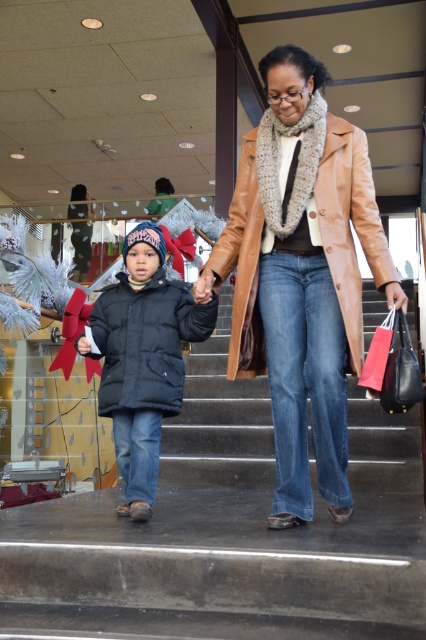
Is leather coat at center taller than matte black jacket at center?

Indeed, leather coat at center has a greater height compared to matte black jacket at center.

Does point (287, 396) come closer to viewer compared to point (123, 369)?

Yes, it is in front of point (123, 369).

I want to click on leather coat at center, so click(301, 275).

Between smooth concrete stairs at center and leather coat at center, which one is positioned higher?

leather coat at center

Does smooth concrete stairs at center have a lesser width compared to leather coat at center?

Incorrect, smooth concrete stairs at center's width is not less than leather coat at center's.

Where is `smooth concrete stairs at center`? smooth concrete stairs at center is located at coordinates (227, 534).

Is smooth concrete stairs at center below matte black jacket at center?

Indeed, smooth concrete stairs at center is positioned under matte black jacket at center.

Describe the element at coordinates (227, 534) in the screenshot. The image size is (426, 640). I see `smooth concrete stairs at center` at that location.

Identify the location of smooth concrete stairs at center. This screenshot has height=640, width=426. (227, 534).